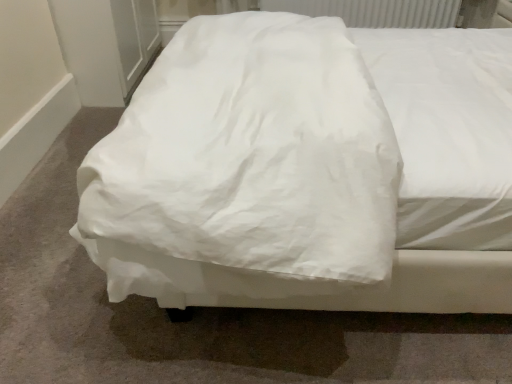
This screenshot has width=512, height=384. Describe the element at coordinates (375, 11) in the screenshot. I see `white textured radiator at upper center` at that location.

I want to click on white textured radiator at upper center, so click(375, 11).

The image size is (512, 384). Find the location of `white textured radiator at upper center`. white textured radiator at upper center is located at coordinates click(x=375, y=11).